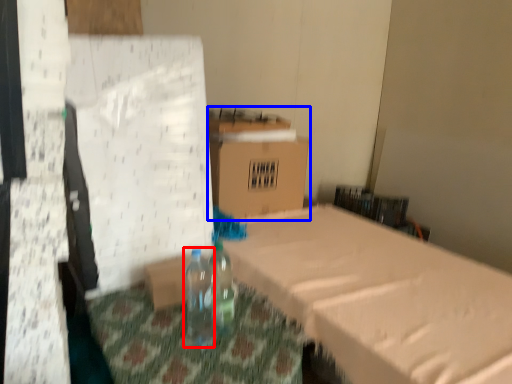
Question: Which object is further to the camera taking this photo, bottle (highlighted by a red box) or cardboard box (highlighted by a blue box)?

Choices:
 (A) bottle
 (B) cardboard box

Answer: (B)